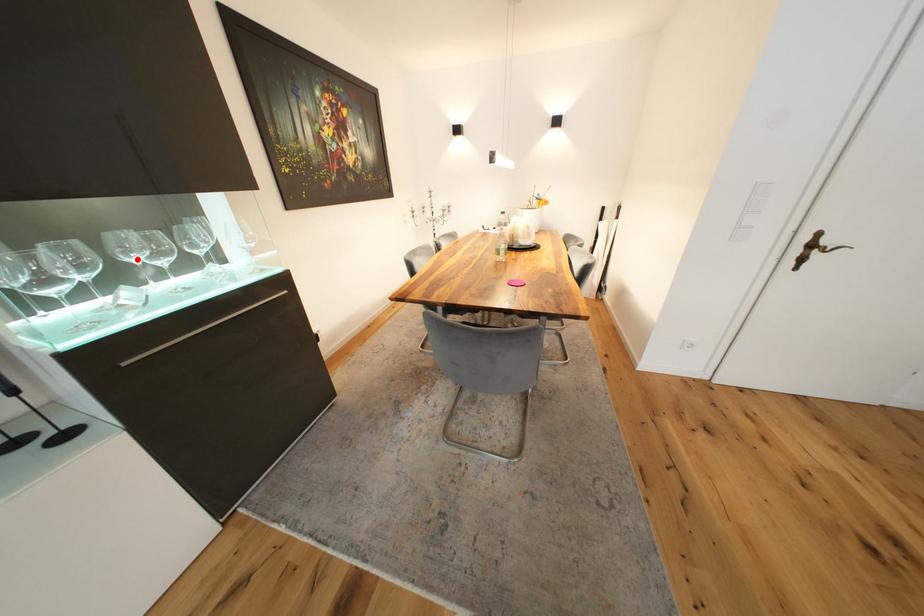
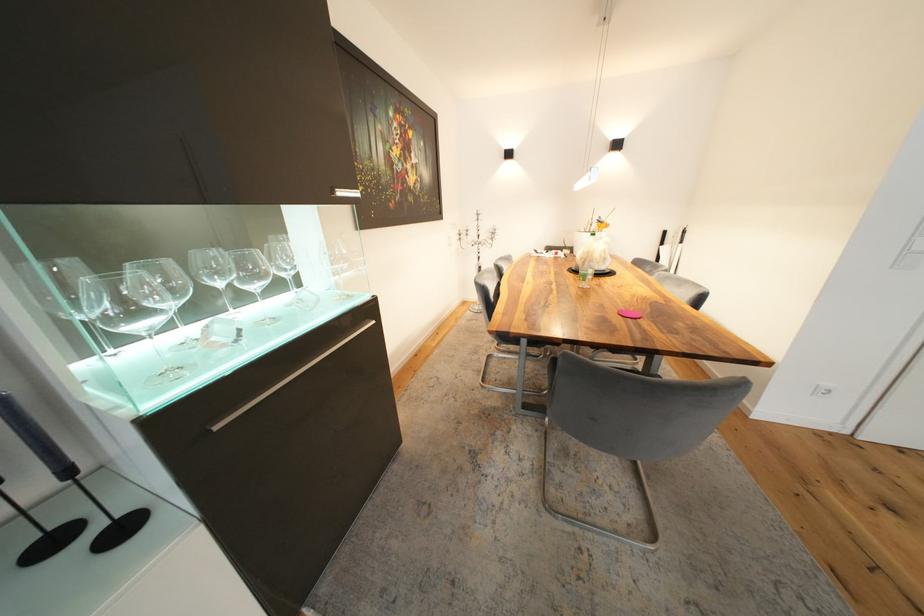
The point at the highlighted location is marked in the first image. Where is the corresponding point in the second image?

(222, 282)